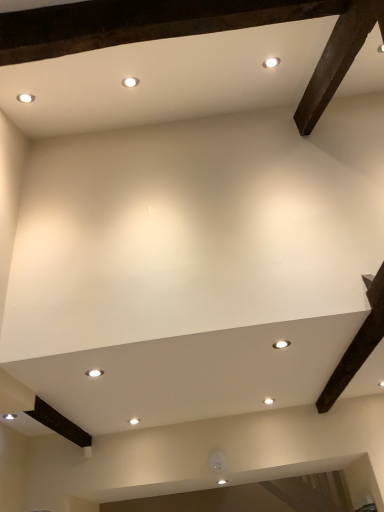
Question: Which direction should I rotate to face white glossy light fixture at center, marked as the second lighting in a top-to-bottom arrangement, — up or down?

Choices:
 (A) down
 (B) up

Answer: (A)

Question: Is white glossy light fixture at center, positioned as the 1th lighting in bottom-to-top order, taller than white glossy light fixture at center, acting as the 1th lighting starting from the top?

Choices:
 (A) no
 (B) yes

Answer: (B)

Question: Is white glossy light fixture at center, positioned as the 1th lighting in bottom-to-top order, placed right next to white glossy light fixture at center, the 1th lighting viewed from the right?

Choices:
 (A) yes
 (B) no

Answer: (B)

Question: Is white glossy light fixture at center, marked as the second lighting in a top-to-bottom arrangement, wider than white glossy light fixture at center, acting as the 1th lighting starting from the top?

Choices:
 (A) no
 (B) yes

Answer: (A)

Question: From the image's perspective, is white glossy light fixture at center, which is the 2th lighting in right-to-left order, beneath white glossy light fixture at center, the second lighting positioned from the bottom?

Choices:
 (A) no
 (B) yes

Answer: (B)

Question: From a real-world perspective, is white glossy light fixture at center, which is the 2th lighting in right-to-left order, positioned over white glossy light fixture at center, the 1th lighting viewed from the right, based on gravity?

Choices:
 (A) yes
 (B) no

Answer: (B)

Question: Is white glossy light fixture at center, arranged as the first lighting when viewed from the left, positioned beyond the bounds of white glossy light fixture at center, the 2th lighting from the left?

Choices:
 (A) yes
 (B) no

Answer: (A)

Question: Is white glossy light fixture at center, acting as the 1th lighting starting from the top, positioned behind white glossy light fixture at center, marked as the second lighting in a top-to-bottom arrangement?

Choices:
 (A) no
 (B) yes

Answer: (A)

Question: From the image's perspective, is white glossy light fixture at center, the 2th lighting from the left, located above white glossy light fixture at center, which is the 2th lighting in right-to-left order?

Choices:
 (A) yes
 (B) no

Answer: (A)

Question: Does white glossy light fixture at center, the 2th lighting from the left, have a larger size compared to white glossy light fixture at center, arranged as the first lighting when viewed from the left?

Choices:
 (A) yes
 (B) no

Answer: (B)

Question: Is white glossy light fixture at center, the 1th lighting viewed from the right, facing towards white glossy light fixture at center, positioned as the 1th lighting in bottom-to-top order?

Choices:
 (A) yes
 (B) no

Answer: (B)

Question: Is white glossy light fixture at center, acting as the 1th lighting starting from the top, closer to the viewer compared to white glossy light fixture at center, which is the 2th lighting in right-to-left order?

Choices:
 (A) yes
 (B) no

Answer: (A)

Question: Considering the relative sizes of white glossy light fixture at center, the second lighting positioned from the bottom, and white glossy light fixture at center, arranged as the first lighting when viewed from the left, in the image provided, is white glossy light fixture at center, the second lighting positioned from the bottom, shorter than white glossy light fixture at center, arranged as the first lighting when viewed from the left,?

Choices:
 (A) yes
 (B) no

Answer: (A)

Question: From a real-world perspective, is white glossy light fixture at center, which is the 2th lighting in right-to-left order, above or below white glossy light fixture at center, the 1th lighting viewed from the right?

Choices:
 (A) above
 (B) below

Answer: (B)